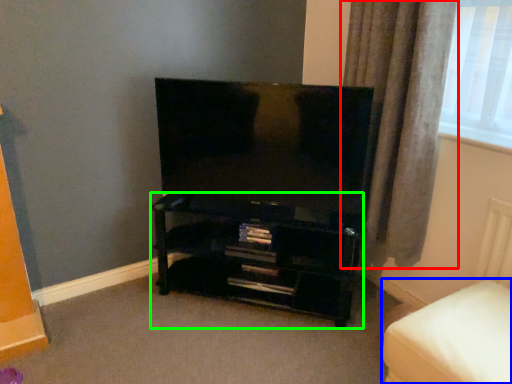
Question: Estimate the real-world distances between objects in this image. Which object is farther from curtain (highlighted by a red box), furniture (highlighted by a blue box) or shelf (highlighted by a green box)?

Choices:
 (A) furniture
 (B) shelf

Answer: (A)